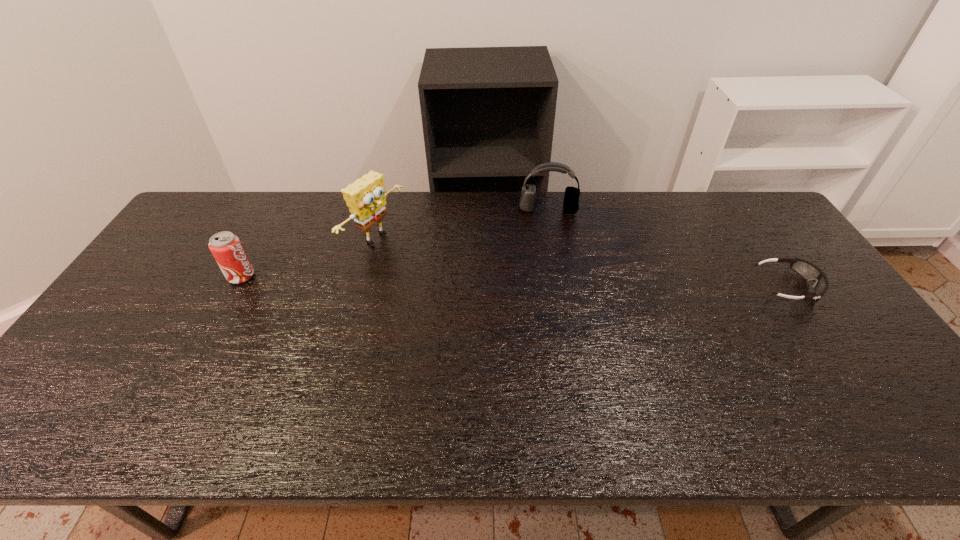
Identify the location of vacant space located 0.390m on the face of the sponge. (504, 304).

I want to click on free space located on the headband of the second object from right to left, so click(547, 251).

Identify the location of vacant position located on the headband of the second object from right to left. This screenshot has width=960, height=540. (547, 271).

At what (x,y) coordinates should I click in order to perform the action: click on free region located 0.180m on the headband of the second object from right to left. Please return your answer as a coordinate pair (x, y). Looking at the image, I should click on pos(547,251).

Find the location of a particular element. This screenshot has width=960, height=540. sponge located at the far edge is located at coordinates (366, 198).

Locate an element on the screen. headset at the far edge is located at coordinates (571, 197).

Locate an element on the screen. Image resolution: width=960 pixels, height=540 pixels. object present at the right edge is located at coordinates (808, 271).

At what (x,y) coordinates should I click in order to perform the action: click on free space at the far edge of the desktop. Please return your answer as a coordinate pair (x, y). Looking at the image, I should click on [458, 202].

In the image, there is a desktop. What are the coordinates of `free region at the near edge` in the screenshot? It's located at (571, 381).

You are a GUI agent. You are given a task and a screenshot of the screen. Output one action in this format:
    pyautogui.click(x=<x>, y=<y>)
    Task: Click on the vacant space at the left edge of the desktop
    This screenshot has height=540, width=960.
    Given the screenshot: What is the action you would take?
    pyautogui.click(x=144, y=280)